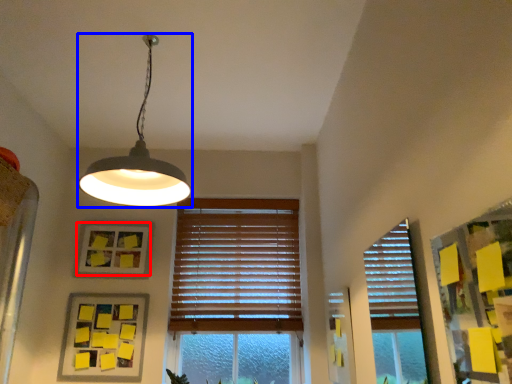
Question: Which of the following is the closest to the observer, picture frame (highlighted by a red box) or lamp (highlighted by a blue box)?

Choices:
 (A) picture frame
 (B) lamp

Answer: (B)